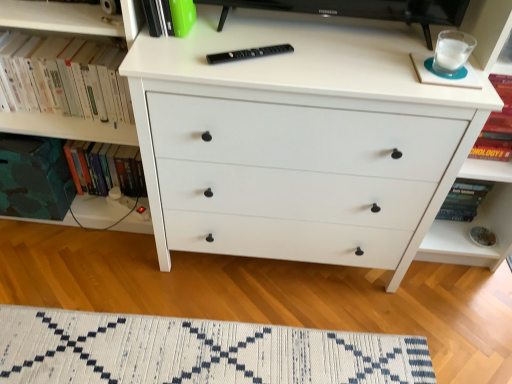
Where is `vacant space to the right of green matte book at upper center, which is counted as the third book, starting from the back`? vacant space to the right of green matte book at upper center, which is counted as the third book, starting from the back is located at coordinates (228, 33).